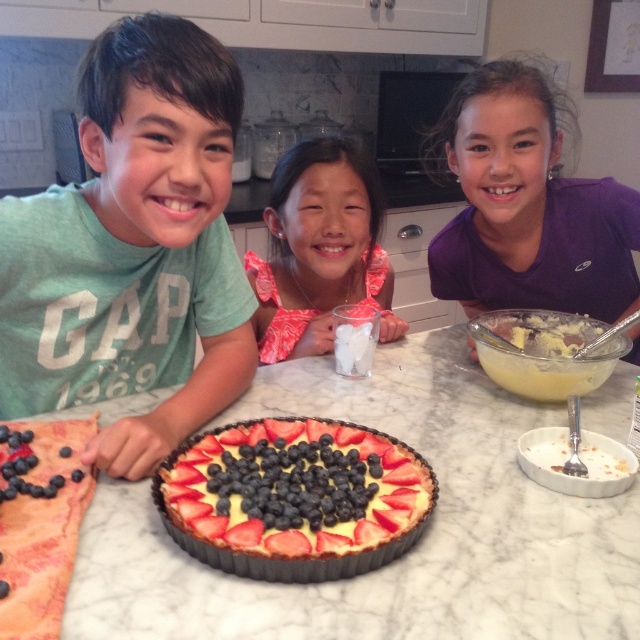
Question: Which point is closer to the camera taking this photo?

Choices:
 (A) (528, 182)
 (B) (468, 387)
 (C) (292, 298)
 (D) (29, 221)

Answer: (D)

Question: Can you confirm if matte green shirt at left is wider than purple cotton shirt at upper right?

Choices:
 (A) yes
 (B) no

Answer: (B)

Question: Which of the following is the farthest from the observer?

Choices:
 (A) matte green shirt at left
 (B) white marble table at center

Answer: (A)

Question: Can you confirm if matte green shirt at left is smaller than pink floral dress at center?

Choices:
 (A) no
 (B) yes

Answer: (A)

Question: Which object is closer to the camera taking this photo?

Choices:
 (A) smooth cream tart at center
 (B) pink floral dress at center

Answer: (A)

Question: Does white marble table at center have a lesser width compared to matte green shirt at left?

Choices:
 (A) no
 (B) yes

Answer: (A)